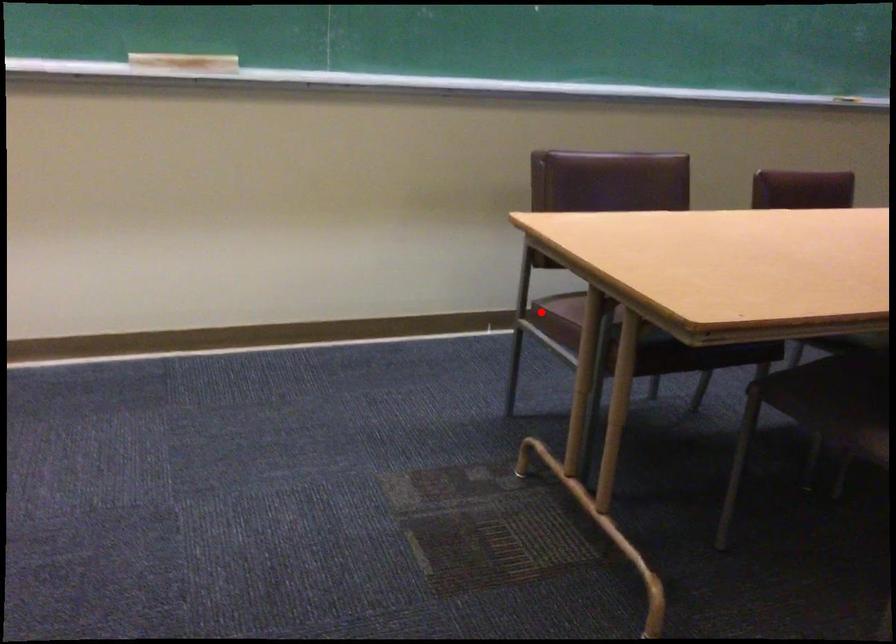
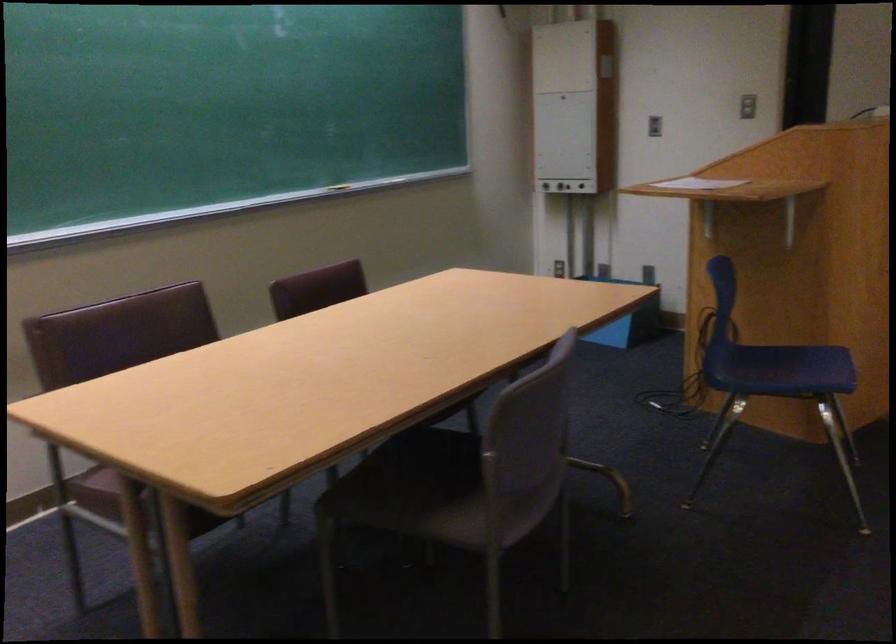
Find the pixel in the second image that matches the highlighted location in the first image.

(96, 491)